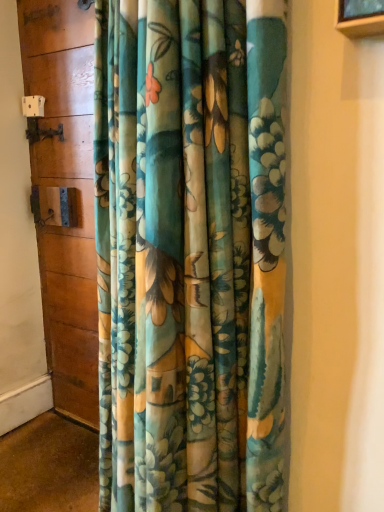
The height and width of the screenshot is (512, 384). What do you see at coordinates (68, 188) in the screenshot?
I see `wooden door at left` at bounding box center [68, 188].

You are a GUI agent. You are given a task and a screenshot of the screen. Output one action in this format:
    pyautogui.click(x=<x>, y=<y>)
    Task: Click on the wooden door at left
    The height and width of the screenshot is (512, 384).
    Given the screenshot: What is the action you would take?
    68,188

Measure the distance between point (83, 173) and camera.

Point (83, 173) is 1.61 meters from camera.

The width and height of the screenshot is (384, 512). What are the coordinates of `wooden door at left` in the screenshot? It's located at click(x=68, y=188).